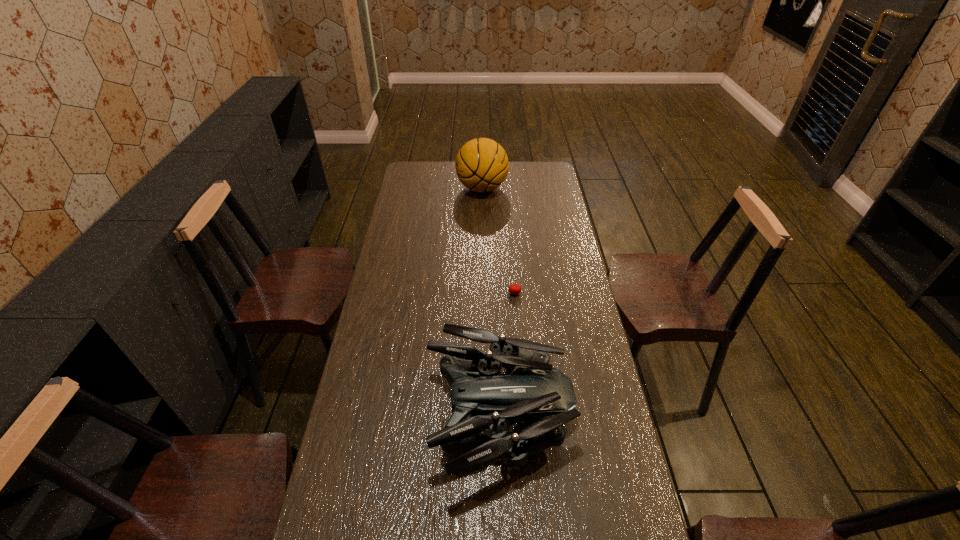
Locate an element on the screen. free space that satisfies the following two spatial constraints: 1. on the back side of the cherry; 2. on the surface of the tallest object near the brand logo is located at coordinates (506, 188).

Image resolution: width=960 pixels, height=540 pixels. Identify the location of free space that satisfies the following two spatial constraints: 1. on the surface of the drone near the brand logo; 2. on the right side of the basketball. (484, 416).

I want to click on free space that satisfies the following two spatial constraints: 1. on the surface of the tallest object near the brand logo; 2. on the left side of the second tallest object, so click(x=484, y=416).

Identify the location of blank area in the image that satisfies the following two spatial constraints: 1. on the surface of the farthest object near the brand logo; 2. on the back side of the drone. Image resolution: width=960 pixels, height=540 pixels. (484, 416).

Image resolution: width=960 pixels, height=540 pixels. In order to click on free region that satisfies the following two spatial constraints: 1. on the surface of the cherry near the brand logo; 2. on the right side of the tallest object in this screenshot , I will do tap(483, 293).

Locate an element on the screen. The image size is (960, 540). blank area in the image that satisfies the following two spatial constraints: 1. on the back side of the nearest object; 2. on the surface of the farthest object near the brand logo is located at coordinates click(x=492, y=188).

At what (x,y) coordinates should I click in order to perform the action: click on blank area in the image that satisfies the following two spatial constraints: 1. on the surface of the shortest object near the brand logo; 2. on the right side of the basketball. Please return your answer as a coordinate pair (x, y). Image resolution: width=960 pixels, height=540 pixels. Looking at the image, I should click on (483, 293).

This screenshot has width=960, height=540. I want to click on vacant space that satisfies the following two spatial constraints: 1. on the surface of the shortest object near the brand logo; 2. on the right side of the farthest object, so click(x=483, y=293).

Where is `free space that satisfies the following two spatial constraints: 1. on the surface of the nearest object near the brand logo; 2. on the left side of the basketball`? The height and width of the screenshot is (540, 960). free space that satisfies the following two spatial constraints: 1. on the surface of the nearest object near the brand logo; 2. on the left side of the basketball is located at coordinates (484, 416).

Where is `free space that satisfies the following two spatial constraints: 1. on the surface of the farthest object near the brand logo; 2. on the back side of the drone`? This screenshot has height=540, width=960. free space that satisfies the following two spatial constraints: 1. on the surface of the farthest object near the brand logo; 2. on the back side of the drone is located at coordinates (484, 416).